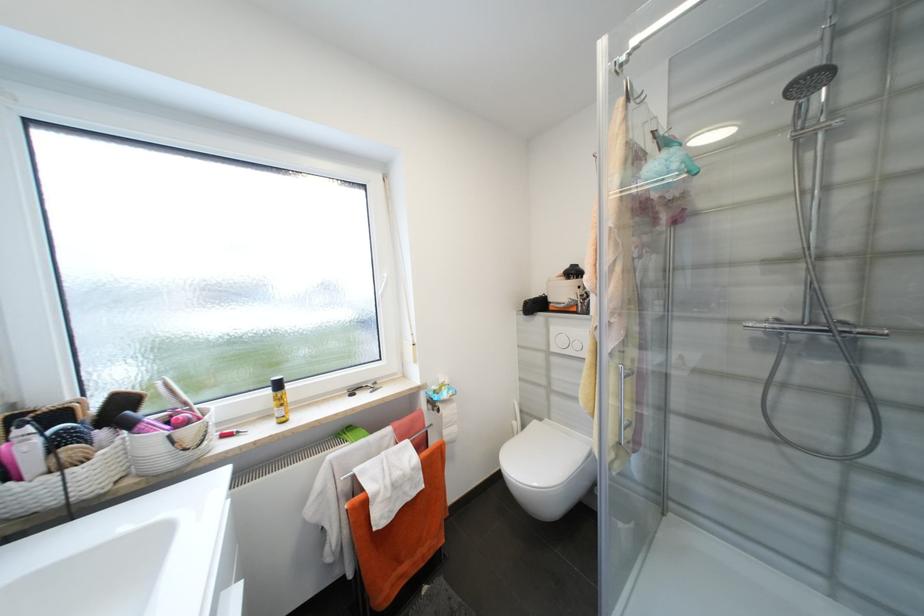
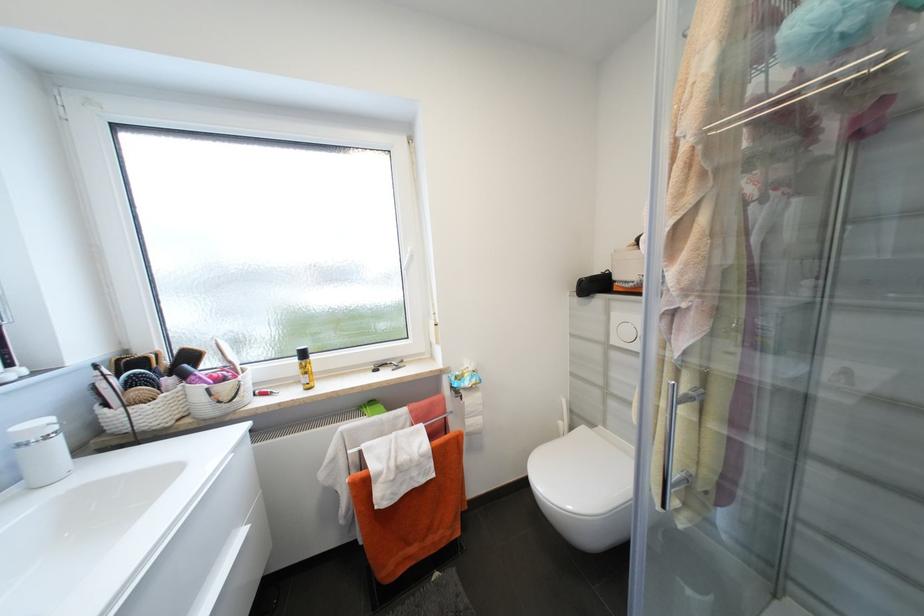
Question: The images are taken continuously from a first-person perspective. In which direction is your viewpoint rotating?

Choices:
 (A) Left
 (B) Right
 (C) Up
 (D) Down

Answer: (A)